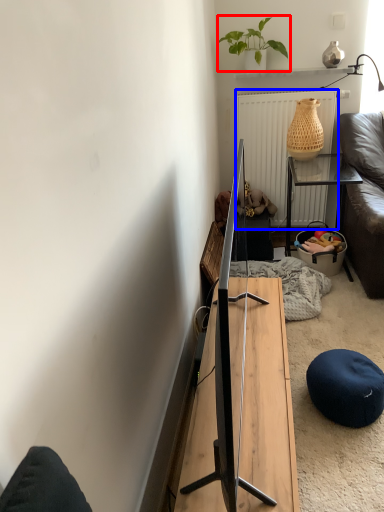
Question: Which object appears farthest to the camera in this image, houseplant (highlighted by a red box) or radiator (highlighted by a blue box)?

Choices:
 (A) houseplant
 (B) radiator

Answer: (B)